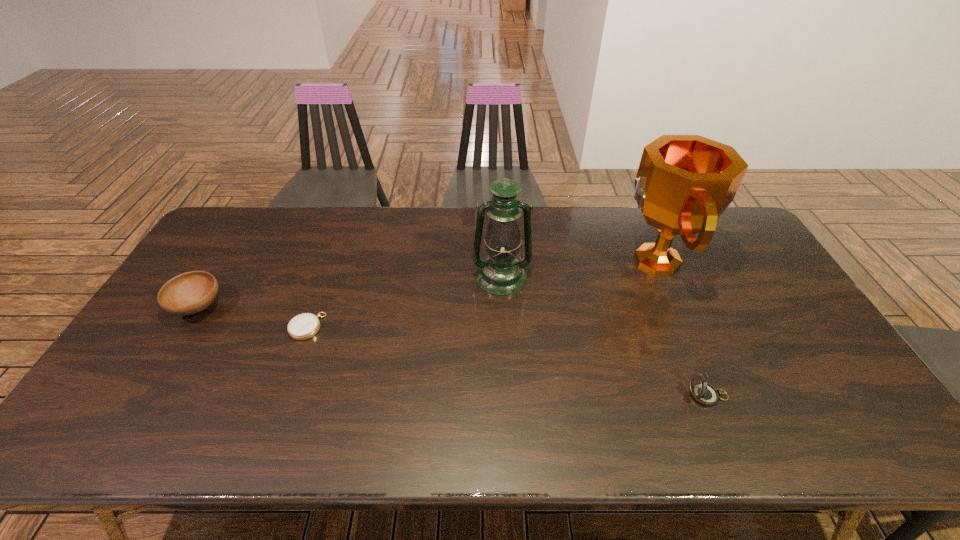
Find the location of a particular element. The height and width of the screenshot is (540, 960). award is located at coordinates (684, 183).

Locate an element on the screen. Image resolution: width=960 pixels, height=540 pixels. oil lamp is located at coordinates (501, 273).

Locate an element on the screen. the nearest object is located at coordinates (704, 393).

Identify the location of the taller compass. (704, 393).

This screenshot has width=960, height=540. In order to click on the leftmost object in this screenshot , I will do `click(189, 293)`.

Locate an element on the screen. Image resolution: width=960 pixels, height=540 pixels. the shorter compass is located at coordinates (303, 326).

The height and width of the screenshot is (540, 960). In order to click on the farther compass in this screenshot , I will do [303, 326].

This screenshot has height=540, width=960. What are the coordinates of `vacant region located 0.130m on the side of the award with the star emblem` in the screenshot? It's located at (577, 260).

What are the coordinates of `free location located on the side of the award with the star emblem` in the screenshot? It's located at (540, 260).

You are a GUI agent. You are given a task and a screenshot of the screen. Output one action in this format:
    pyautogui.click(x=<x>, y=<y>)
    Task: Click on the free space located 0.180m on the side of the award with the star emblem
    The width and height of the screenshot is (960, 540).
    Given the screenshot: What is the action you would take?
    pyautogui.click(x=562, y=260)